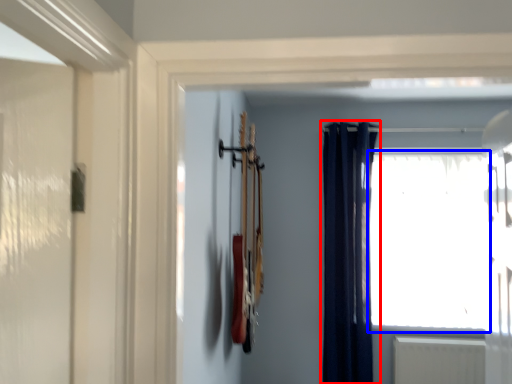
Question: Which object is further to the camera taking this photo, curtain (highlighted by a red box) or window (highlighted by a blue box)?

Choices:
 (A) curtain
 (B) window

Answer: (B)